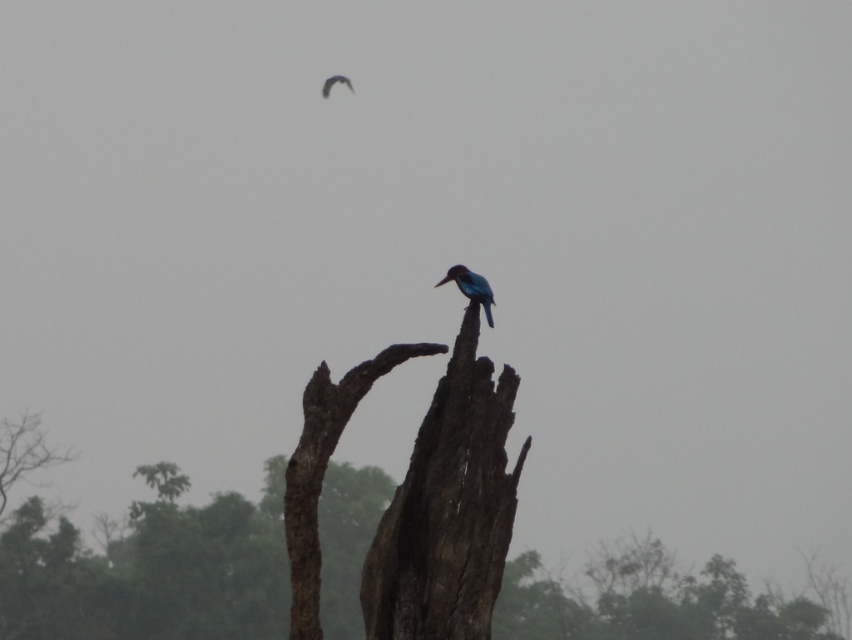
Question: Among these objects, which one is farthest from the camera?

Choices:
 (A) smooth brown wood at center
 (B) blue glossy bird at center
 (C) shiny blue bird at upper center

Answer: (C)

Question: Is blue glossy bird at center closer to camera compared to shiny blue bird at upper center?

Choices:
 (A) yes
 (B) no

Answer: (A)

Question: Which point is farther from the camera taking this photo?

Choices:
 (A) (440, 282)
 (B) (475, 376)
 (C) (323, 88)

Answer: (C)

Question: Which of the following is the closest to the observer?

Choices:
 (A) blue glossy bird at center
 (B) smooth brown wood at center
 (C) shiny blue bird at upper center

Answer: (B)

Question: Is blue glossy bird at center to the left of shiny blue bird at upper center from the viewer's perspective?

Choices:
 (A) yes
 (B) no

Answer: (B)

Question: Is smooth brown wood at center smaller than shiny blue bird at upper center?

Choices:
 (A) yes
 (B) no

Answer: (A)